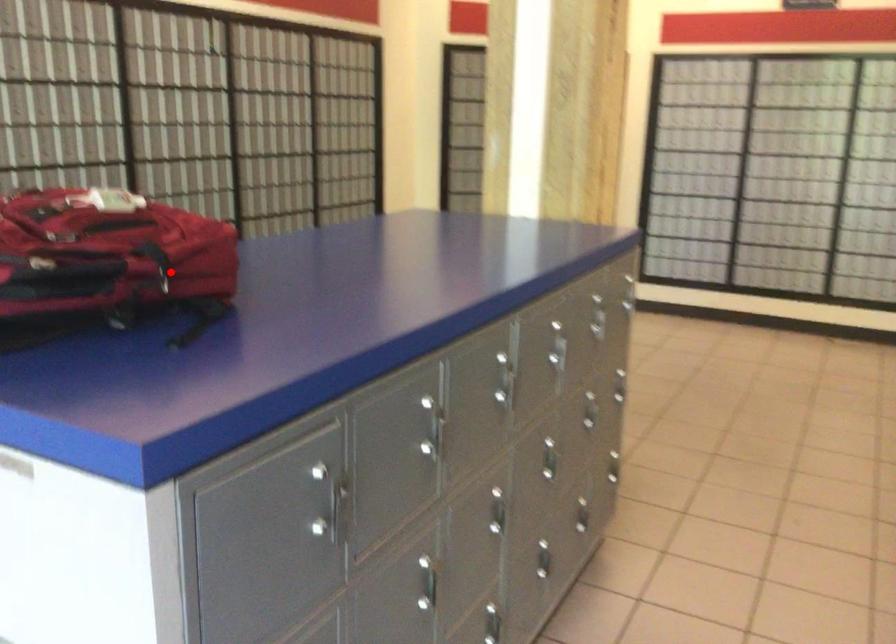
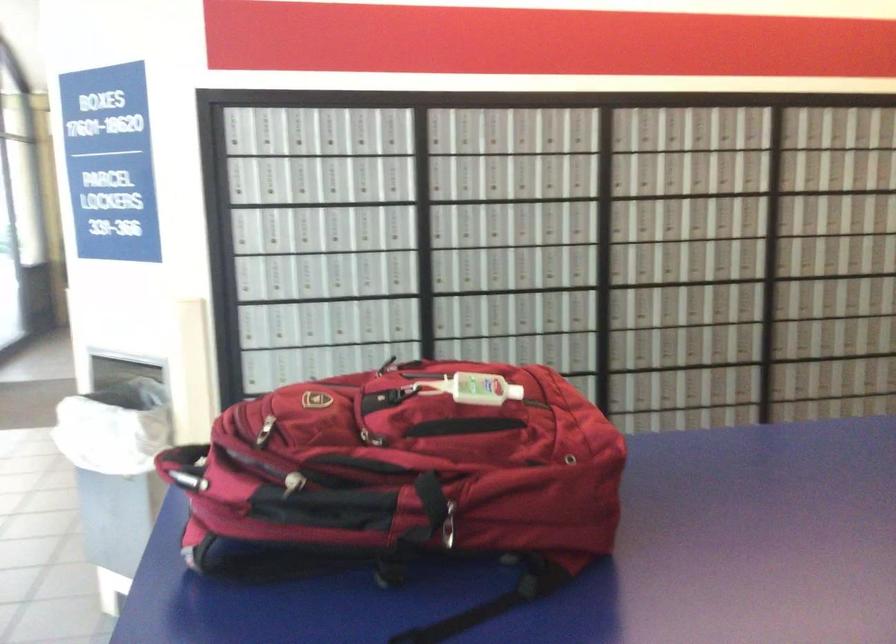
Question: I am providing you with two images of the same scene from different viewpoints. A red point is marked on the first image. At the location where the point appears in image 1, is it still visible in image 2?

Choices:
 (A) Yes
 (B) No

Answer: (A)